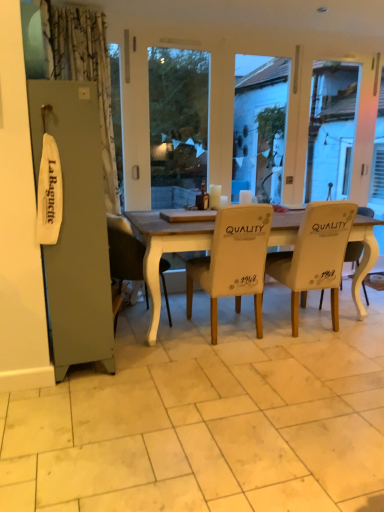
Where is `white fabric chair at center, which ranks as the 2th chair in right-to-left order`? white fabric chair at center, which ranks as the 2th chair in right-to-left order is located at coordinates pyautogui.click(x=315, y=255).

Find the location of a particular element. The height and width of the screenshot is (512, 384). white fabric chair at center, which is counted as the 4th chair, starting from the right is located at coordinates (124, 251).

What's the angular difference between white fabric chair at center, which is counted as the 4th chair, starting from the right, and white fabric chair at right, positioned as the fourth chair in left-to-right order,'s facing directions?

The facing directions of white fabric chair at center, which is counted as the 4th chair, starting from the right, and white fabric chair at right, positioned as the fourth chair in left-to-right order, are 180 degrees apart.

Would you say white fabric chair at center, which is counted as the 4th chair, starting from the right, is to the left or to the right of white fabric chair at right, arranged as the first chair when viewed from the right, in the picture?

white fabric chair at center, which is counted as the 4th chair, starting from the right, is positioned on white fabric chair at right, arranged as the first chair when viewed from the right,'s left side.

Is there a large distance between white fabric chair at center, which is counted as the 4th chair, starting from the right, and white fabric chair at right, positioned as the fourth chair in left-to-right order?

Yes, white fabric chair at center, which is counted as the 4th chair, starting from the right, is far from white fabric chair at right, positioned as the fourth chair in left-to-right order.

Relative to white fabric chair at right, arranged as the first chair when viewed from the right, is white fabric chair at center, acting as the 1th chair starting from the left, in front or behind?

Visually, white fabric chair at center, acting as the 1th chair starting from the left, is located in front of white fabric chair at right, arranged as the first chair when viewed from the right.

Is white tile at center at the right side of white fabric chair at center, which is counted as the 4th chair, starting from the right?

Correct, you'll find white tile at center to the right of white fabric chair at center, which is counted as the 4th chair, starting from the right.

From the image's perspective, is white tile at center on top of white fabric chair at center, acting as the 1th chair starting from the left?

Actually, white tile at center appears below white fabric chair at center, acting as the 1th chair starting from the left, in the image.

From a real-world perspective, which is physically below, white tile at center or white fabric chair at center, acting as the 1th chair starting from the left?

From a 3D spatial view, white tile at center is below.

Does white tile at center have a smaller size compared to white fabric chair at center, which is counted as the 4th chair, starting from the right?

No, white tile at center is not smaller than white fabric chair at center, which is counted as the 4th chair, starting from the right.

From a real-world perspective, is white fabric chair at center, which is counted as the 4th chair, starting from the right, above or below white fabric chair at center, which ranks as the 2th chair in right-to-left order?

In terms of real-world spatial position, white fabric chair at center, which is counted as the 4th chair, starting from the right, is below white fabric chair at center, which ranks as the 2th chair in right-to-left order.

Is white fabric chair at center, acting as the 1th chair starting from the left, turned away from white fabric chair at center, which ranks as the 2th chair in right-to-left order?

white fabric chair at center, acting as the 1th chair starting from the left, is not turned away from white fabric chair at center, which ranks as the 2th chair in right-to-left order.

Consider the image. Considering the sizes of white fabric chair at center, which is counted as the 4th chair, starting from the right, and white fabric chair at center, which ranks as the 2th chair in right-to-left order, in the image, is white fabric chair at center, which is counted as the 4th chair, starting from the right, wider or thinner than white fabric chair at center, which ranks as the 2th chair in right-to-left order,?

In the image, white fabric chair at center, which is counted as the 4th chair, starting from the right, appears to be more narrow than white fabric chair at center, which ranks as the 2th chair in right-to-left order.

Considering the sizes of objects white fabric chair at center, acting as the 1th chair starting from the left, and white fabric chair at center, which ranks as the 2th chair in right-to-left order, in the image provided, who is smaller, white fabric chair at center, acting as the 1th chair starting from the left, or white fabric chair at center, which ranks as the 2th chair in right-to-left order,?

Smaller between the two is white fabric chair at center, acting as the 1th chair starting from the left.

From a real-world perspective, who is located lower, white fabric chair at right, arranged as the first chair when viewed from the right, or white leather chair at center, the 2th chair positioned from the left?

white fabric chair at right, arranged as the first chair when viewed from the right, from a real-world perspective.

Is white fabric chair at right, arranged as the first chair when viewed from the right, oriented away from white leather chair at center, the 2th chair positioned from the left?

white fabric chair at right, arranged as the first chair when viewed from the right, does not have its back to white leather chair at center, the 2th chair positioned from the left.

Is white fabric chair at right, arranged as the first chair when viewed from the right, at the left side of white leather chair at center, the 2th chair positioned from the left?

In fact, white fabric chair at right, arranged as the first chair when viewed from the right, is to the right of white leather chair at center, the 2th chair positioned from the left.

How different are the orientations of white fabric chair at center, which ranks as the 2th chair in right-to-left order, and white leather chair at center, the 2th chair positioned from the left, in degrees?

white fabric chair at center, which ranks as the 2th chair in right-to-left order, and white leather chair at center, the 2th chair positioned from the left, are facing 0.000703 degrees away from each other.

Could you tell me if white fabric chair at center, which ranks as the 2th chair in right-to-left order, is turned towards white leather chair at center, the 2th chair positioned from the left?

→ No, white fabric chair at center, which ranks as the 2th chair in right-to-left order, is not turned towards white leather chair at center, the 2th chair positioned from the left.

Is white leather chair at center, the 3th chair viewed from the right, a part of white fabric chair at center, placed as the 3th chair when sorted from left to right?

No, white leather chair at center, the 3th chair viewed from the right, is not surrounded by white fabric chair at center, placed as the 3th chair when sorted from left to right.

Measure the distance between white fabric chair at center, placed as the 3th chair when sorted from left to right, and white fabric chair at right, arranged as the first chair when viewed from the right.

16.37 inches.

Is white fabric chair at center, which ranks as the 2th chair in right-to-left order, positioned behind white fabric chair at right, positioned as the fourth chair in left-to-right order?

No, it is not.

Is point (280, 262) positioned behind point (323, 290)?

No, it is not.

Are white leather chair at center, the 2th chair positioned from the left, and white fabric chair at center, which ranks as the 2th chair in right-to-left order, beside each other?

No, white leather chair at center, the 2th chair positioned from the left, is not making contact with white fabric chair at center, which ranks as the 2th chair in right-to-left order.

What's the angular difference between white leather chair at center, the 3th chair viewed from the right, and white fabric chair at center, placed as the 3th chair when sorted from left to right,'s facing directions?

white leather chair at center, the 3th chair viewed from the right, and white fabric chair at center, placed as the 3th chair when sorted from left to right, are facing 0.000703 degrees away from each other.

Which of these two, white leather chair at center, the 3th chair viewed from the right, or white fabric chair at center, which ranks as the 2th chair in right-to-left order, stands shorter?

white leather chair at center, the 3th chair viewed from the right, is shorter.

From the white fabric chair at center, acting as the 1th chair starting from the left, count 3rd chair to the right and point to it. Please provide its 2D coordinates.

[(358, 255)]

You are a GUI agent. You are given a task and a screenshot of the screen. Output one action in this format:
    pyautogui.click(x=<x>, y=<y>)
    Task: Click on the 2nd chair counting from the left side of the white tile at center
    This screenshot has height=512, width=384.
    Given the screenshot: What is the action you would take?
    pyautogui.click(x=124, y=251)

When comparing their distances from white leather chair at center, the 3th chair viewed from the right, does white fabric chair at right, positioned as the fourth chair in left-to-right order, or white tile at center seem further?

Among the two, white fabric chair at right, positioned as the fourth chair in left-to-right order, is located further to white leather chair at center, the 3th chair viewed from the right.

Estimate the real-world distances between objects in this image. Which object is closer to white tile at center, white leather chair at center, the 2th chair positioned from the left, or white fabric chair at right, arranged as the first chair when viewed from the right?

white leather chair at center, the 2th chair positioned from the left, is positioned closer to the anchor white tile at center.

Considering their positions, is white fabric chair at center, acting as the 1th chair starting from the left, positioned further to white leather chair at center, the 2th chair positioned from the left, than white tile at center?

Among the two, white tile at center is located further to white leather chair at center, the 2th chair positioned from the left.

When comparing their distances from white tile at center, does white fabric chair at right, arranged as the first chair when viewed from the right, or white fabric chair at center, which is counted as the 4th chair, starting from the right, seem closer?

white fabric chair at center, which is counted as the 4th chair, starting from the right, is closer to white tile at center.

Estimate the real-world distances between objects in this image. Which object is closer to white fabric chair at right, positioned as the fourth chair in left-to-right order, white fabric chair at center, acting as the 1th chair starting from the left, or white fabric chair at center, which ranks as the 2th chair in right-to-left order?

Among the two, white fabric chair at center, which ranks as the 2th chair in right-to-left order, is located nearer to white fabric chair at right, positioned as the fourth chair in left-to-right order.

Based on the photo, considering their positions, is white tile at center positioned closer to white fabric chair at center, which ranks as the 2th chair in right-to-left order, than white fabric chair at center, acting as the 1th chair starting from the left?

Based on the image, white tile at center appears to be nearer to white fabric chair at center, which ranks as the 2th chair in right-to-left order.

Based on their spatial positions, is white fabric chair at center, placed as the 3th chair when sorted from left to right, or white fabric chair at right, positioned as the fourth chair in left-to-right order, closer to white fabric chair at center, acting as the 1th chair starting from the left?

white fabric chair at center, placed as the 3th chair when sorted from left to right.

Considering their positions, is white fabric chair at right, arranged as the first chair when viewed from the right, positioned closer to white tile at center than white leather chair at center, the 2th chair positioned from the left?

white leather chair at center, the 2th chair positioned from the left.

Find the location of `chair between white fabric chair at center, acting as the 1th chair starting from the left, and white fabric chair at center, placed as the 3th chair when sorted from left to right, in the horizontal direction`. chair between white fabric chair at center, acting as the 1th chair starting from the left, and white fabric chair at center, placed as the 3th chair when sorted from left to right, in the horizontal direction is located at coordinates (233, 261).

Find the location of a particular element. The width and height of the screenshot is (384, 512). chair positioned between white tile at center and white fabric chair at center, which ranks as the 2th chair in right-to-left order, from near to far is located at coordinates (233, 261).

Where is `chair between white leather chair at center, the 2th chair positioned from the left, and white fabric chair at right, arranged as the first chair when viewed from the right, from left to right`? chair between white leather chair at center, the 2th chair positioned from the left, and white fabric chair at right, arranged as the first chair when viewed from the right, from left to right is located at coordinates (315, 255).